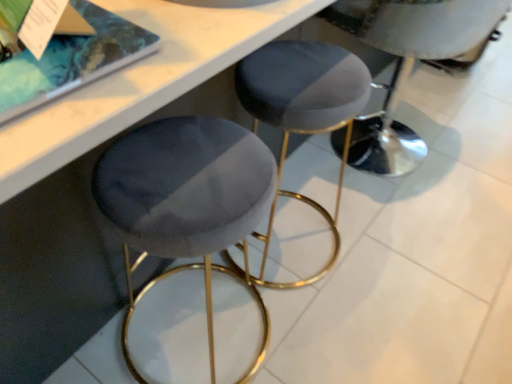
Locate an element on the screen. This screenshot has width=512, height=384. vacant region in front of velvet grey stool at center is located at coordinates (412, 229).